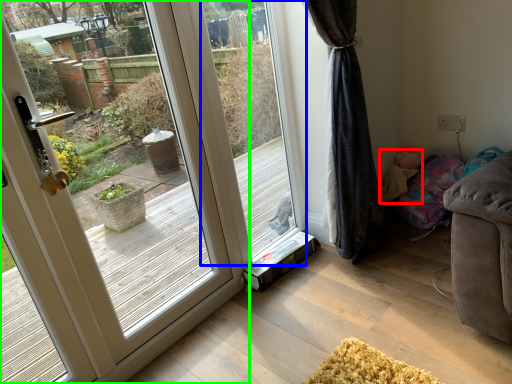
Question: Based on their relative distances, which object is farther from child (highlighted by a red box)? Choose from window screen (highlighted by a blue box) and door (highlighted by a green box).

Choices:
 (A) window screen
 (B) door

Answer: (B)